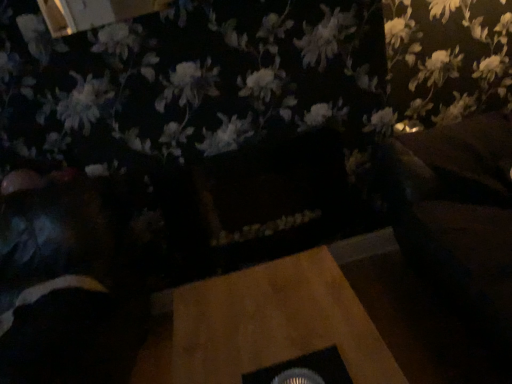
What is the approximate width of wooden textured round table at center?

wooden textured round table at center is 25.63 inches in width.

What do you see at coordinates (275, 322) in the screenshot? I see `wooden textured round table at center` at bounding box center [275, 322].

Identify the location of wooden textured round table at center. (275, 322).

What is the approximate height of wooden textured round table at center?

It is 20.23 inches.

Locate an element on the screen. The width and height of the screenshot is (512, 384). wooden textured round table at center is located at coordinates (275, 322).